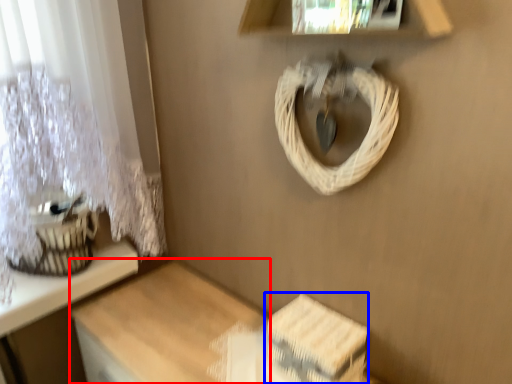
Question: Which object is closer to the camera taking this photo, table (highlighted by a red box) or storage box (highlighted by a blue box)?

Choices:
 (A) table
 (B) storage box

Answer: (A)